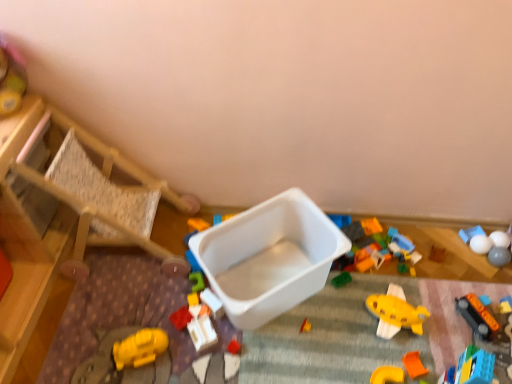
Image resolution: width=512 pixels, height=384 pixels. In order to click on vacant space behind orange plastic train at lower right, the tenth toy in the left-to-right sequence in this screenshot , I will do `click(456, 294)`.